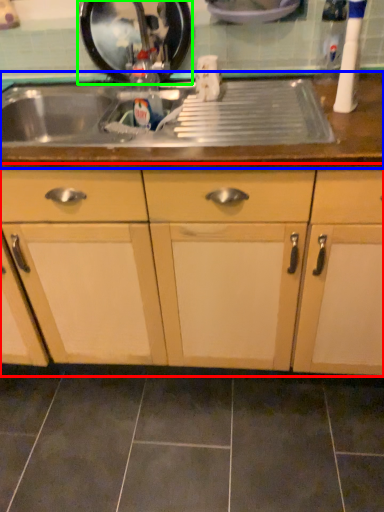
Question: Which object is the closest to the cabinetry (highlighted by a red box)? Choose among these: countertop (highlighted by a blue box) or appliance (highlighted by a green box).

Choices:
 (A) countertop
 (B) appliance

Answer: (A)